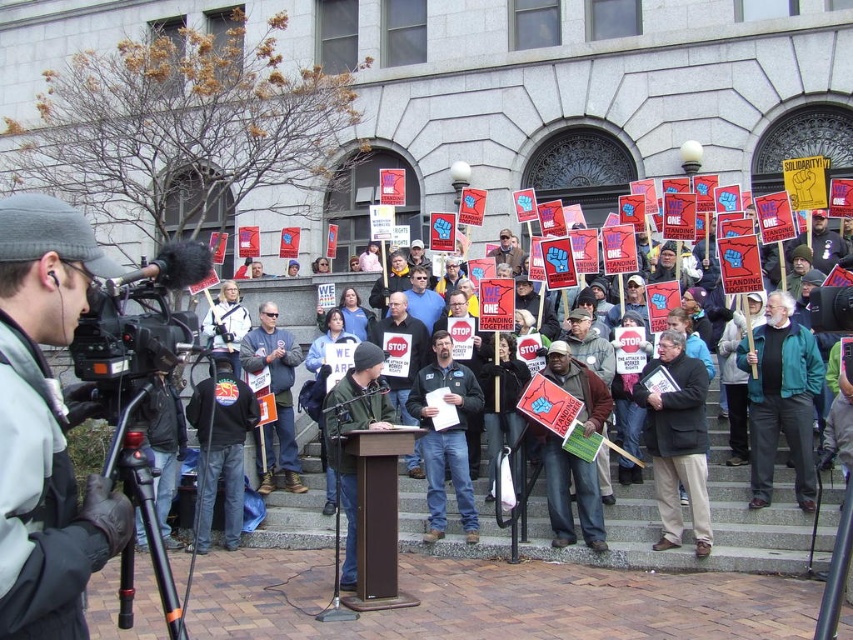
You are a photographer at the protest scene. You need to position yourself to capture the speaker at the podium and the matte black camera at left in your shot. Where should you stand relative to the camera?

You should stand to the right of the matte black camera at left to include both the speaker at the podium and the camera in your shot since the camera is positioned at the far left edge of the scene.

You are a technician in charge of setting up equipment for a live broadcast. You have two cameras at the left side of the scene. The matte black camera at left and the black plastic video camera at left. You need to ensure that the cameras are positioned at least 2 meters apart to avoid signal interference. Based on the scene description, will you need to adjust their positions?

The distance between the matte black camera at left and the black plastic video camera at left is 1.89 meters. Since this is less than the required 2 meters, you will need to adjust their positions to increase the distance between them to meet the signal interference requirement.